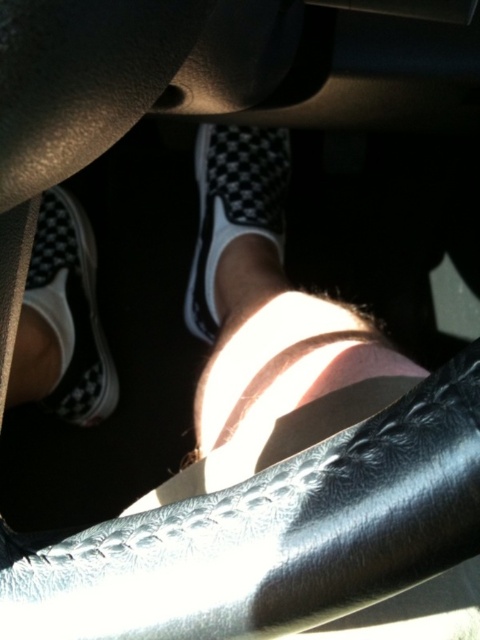
Can you confirm if checkerboard fabric shoe at lower left is bigger than black checkered slip-on shoe at center?

Indeed, checkerboard fabric shoe at lower left has a larger size compared to black checkered slip-on shoe at center.

Does checkerboard fabric shoe at lower left have a greater height compared to black checkered slip-on shoe at center?

Yes, checkerboard fabric shoe at lower left is taller than black checkered slip-on shoe at center.

What do you see at coordinates (71, 308) in the screenshot? This screenshot has width=480, height=640. I see `checkerboard fabric shoe at lower left` at bounding box center [71, 308].

You are a GUI agent. You are given a task and a screenshot of the screen. Output one action in this format:
    pyautogui.click(x=<x>, y=<y>)
    Task: Click on the checkerboard fabric shoe at lower left
    Image resolution: width=480 pixels, height=640 pixels.
    Given the screenshot: What is the action you would take?
    pyautogui.click(x=71, y=308)